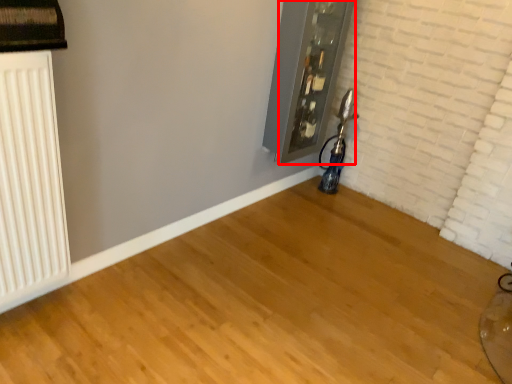
Question: In this image, where is window frame (annotated by the red box) located relative to radiator?

Choices:
 (A) right
 (B) left

Answer: (A)